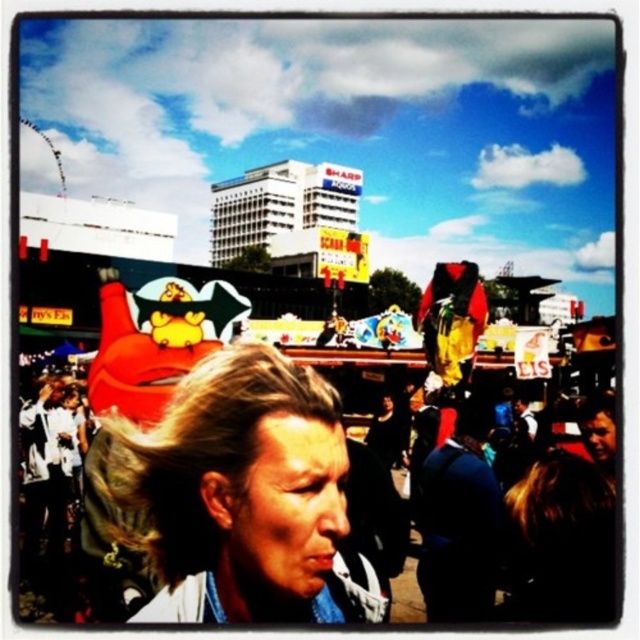
Is point (552, 451) more distant than point (317, 412)?

Yes, it is.

Can you confirm if white fabric at center is smaller than blonde hair at center?

No.

Does point (518, 500) come farther from viewer compared to point (328, 486)?

Yes.

Where is `white fabric at center`? This screenshot has width=640, height=640. white fabric at center is located at coordinates (291, 502).

Does white fabric at center have a lesser width compared to blue fabric jacket at center?

In fact, white fabric at center might be wider than blue fabric jacket at center.

Can you confirm if white fabric at center is positioned to the right of blue fabric jacket at center?

Incorrect, white fabric at center is not on the right side of blue fabric jacket at center.

Is point (438, 582) positioned in front of point (481, 481)?

Yes, point (438, 582) is closer to viewer.

Image resolution: width=640 pixels, height=640 pixels. What are the coordinates of `white fabric at center` in the screenshot? It's located at (291, 502).

Who is taller, blonde hair at center or blue fabric jacket at center?

With more height is blonde hair at center.

Is point (333, 486) farther from viewer compared to point (472, 548)?

No, (333, 486) is closer to viewer.

The width and height of the screenshot is (640, 640). What are the coordinates of `blonde hair at center` in the screenshot? It's located at [x=240, y=492].